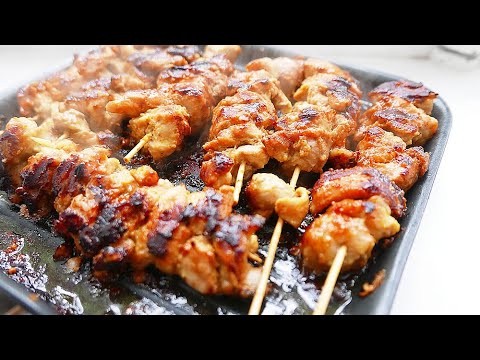
Identify the location of tray. The height and width of the screenshot is (360, 480). (413, 211).